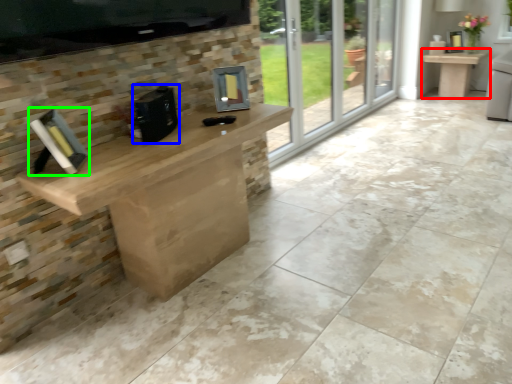
Question: Estimate the real-world distances between objects in this image. Which object is farther from table (highlighted by a red box), appliance (highlighted by a blue box) or book (highlighted by a green box)?

Choices:
 (A) appliance
 (B) book

Answer: (B)